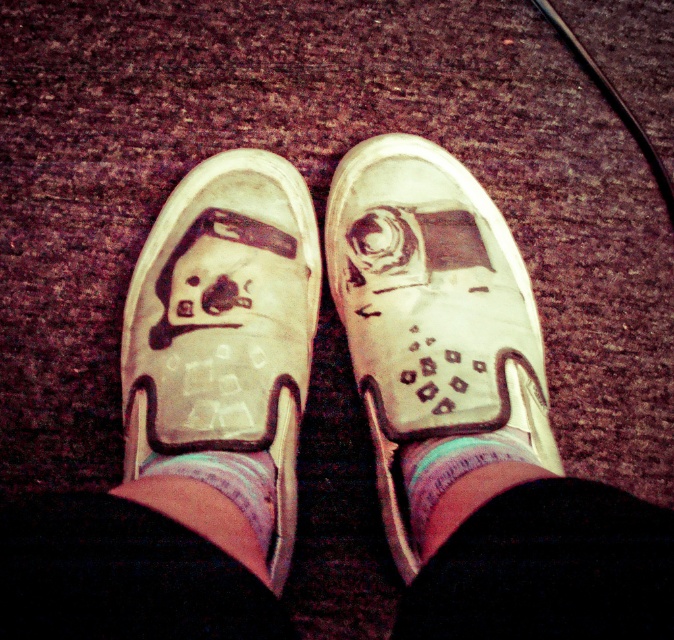
Question: Which point is closer to the camera?

Choices:
 (A) (400, 273)
 (B) (458, 497)
 (C) (216, 468)

Answer: (B)

Question: Which point appears farthest from the camera in this image?

Choices:
 (A) (417, 515)
 (B) (408, 344)
 (C) (266, 230)
 (D) (253, 516)

Answer: (C)

Question: Which object appears farthest from the camera in this image?

Choices:
 (A) multicolored fabric sock at center
 (B) white cotton sock at center
 (C) white canvas shoe at center

Answer: (C)

Question: Is white suede shoe at center to the left of multicolored fabric sock at center from the viewer's perspective?

Choices:
 (A) no
 (B) yes

Answer: (B)

Question: Can you confirm if white suede shoe at center is smaller than multicolored fabric sock at center?

Choices:
 (A) no
 (B) yes

Answer: (A)

Question: Is white canvas shoe at center to the right of multicolored fabric sock at center from the viewer's perspective?

Choices:
 (A) yes
 (B) no

Answer: (B)